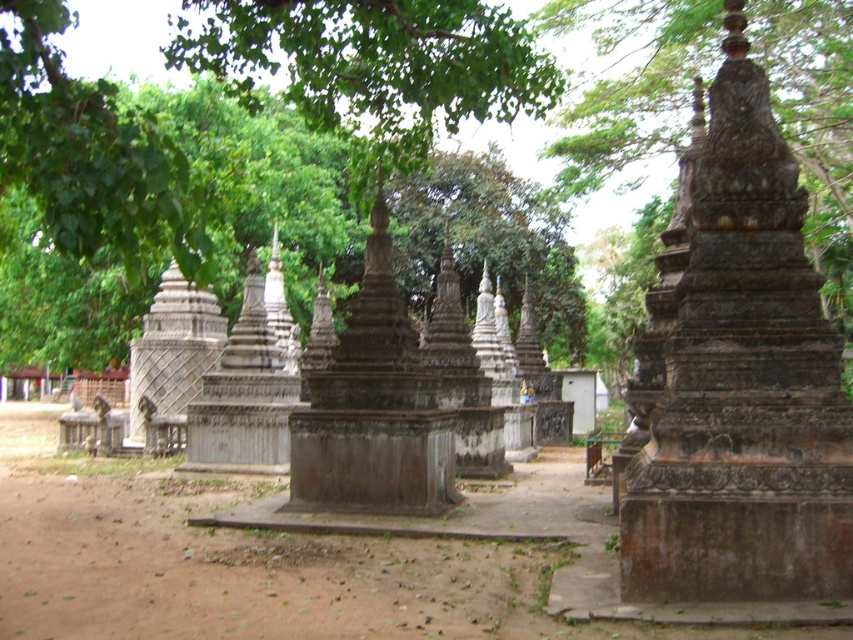
Consider the image. Between gray stone stupa at center and brown dirt field at center, which one appears on the left side from the viewer's perspective?

brown dirt field at center

Consider the image. Who is more forward, (657,461) or (195,480)?

Positioned in front is point (657,461).

Locate an element on the screen. gray stone stupa at center is located at coordinates (743, 385).